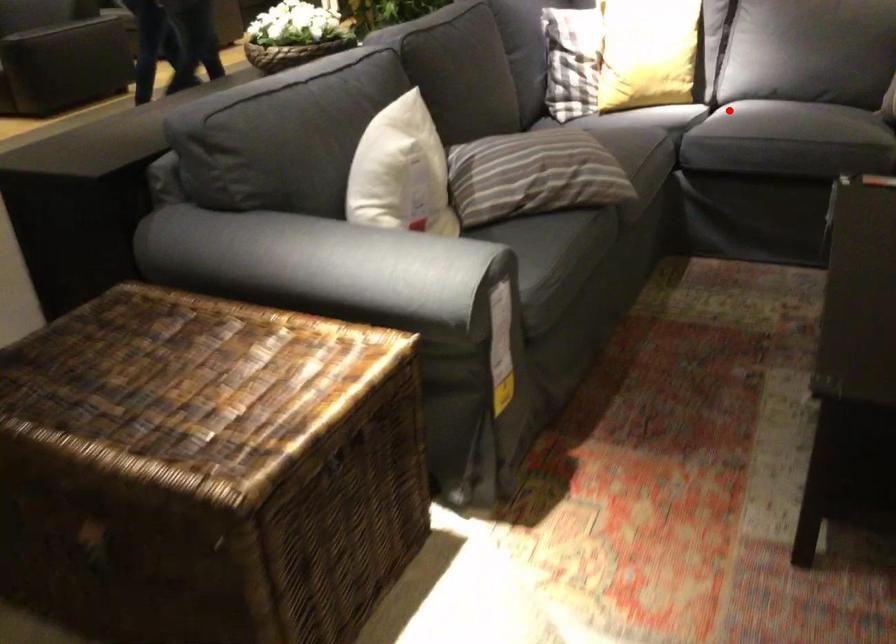
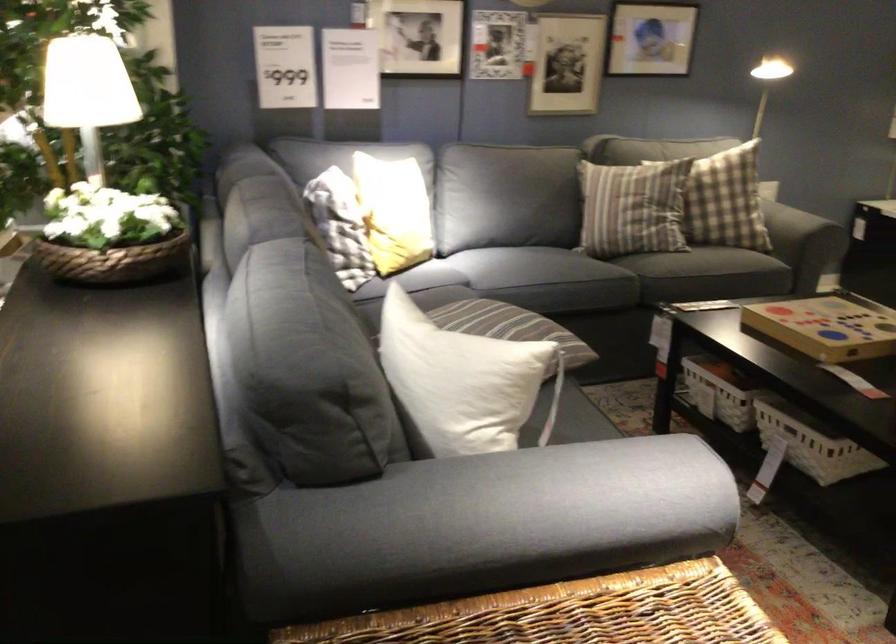
Question: I am providing you with two images of the same scene from different viewpoints. A red point is marked on the first image. At the location where the point appears in image 1, is it still visible in image 2?

Choices:
 (A) Yes
 (B) No

Answer: (A)